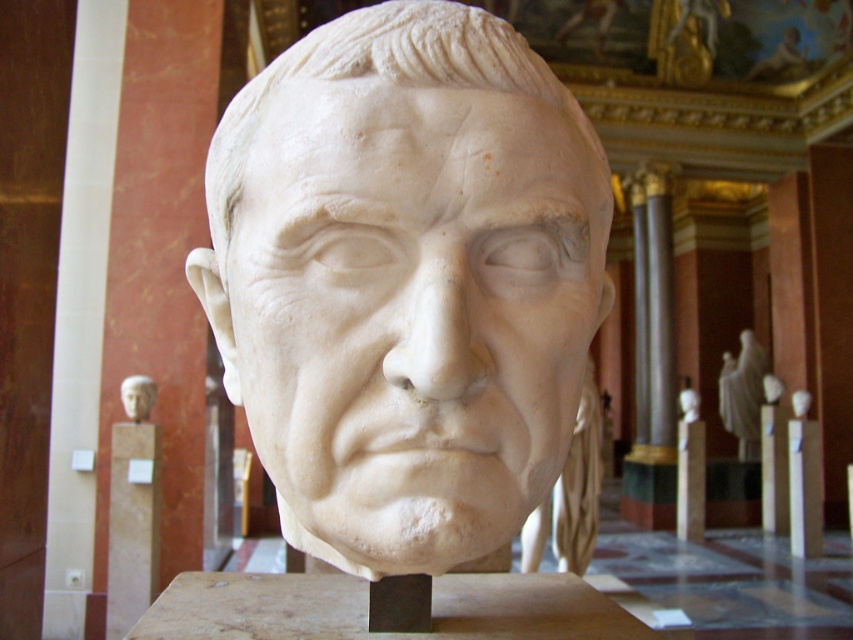
How much distance is there between white marble statue at center and white marble head at upper left?

They are 9.63 meters apart.

Who is positioned more to the left, white marble statue at center or white marble head at upper left?

white marble head at upper left is more to the left.

The height and width of the screenshot is (640, 853). Identify the location of white marble statue at center. (743, 394).

Locate an element on the screen. The image size is (853, 640). white marble statue at center is located at coordinates (743, 394).

Between white marble bust at center and white marble statue at center, which one has more height?

white marble statue at center

Identify the location of white marble bust at center. The image size is (853, 640). (410, 314).

From the picture: Who is more forward, (467, 195) or (733, 380)?

Positioned in front is point (467, 195).

I want to click on white marble bust at center, so coord(410,314).

Is white marble bust at center in front of white marble head at upper left?

Yes.

Describe the element at coordinates (410, 314) in the screenshot. I see `white marble bust at center` at that location.

Who is more forward, (241, 376) or (122, 394)?

Positioned in front is point (241, 376).

This screenshot has height=640, width=853. Find the location of `white marble bust at center`. white marble bust at center is located at coordinates (410, 314).